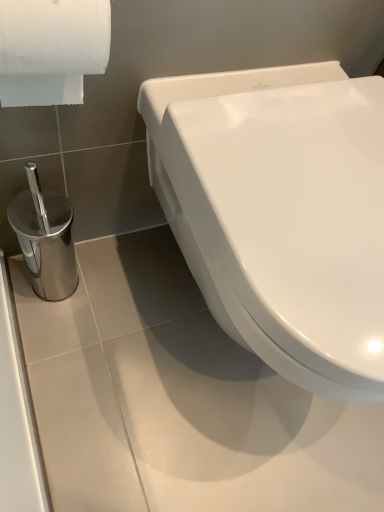
Locate an element on the screen. The image size is (384, 512). vacant space situated above white glossy toilet at center (from a real-world perspective) is located at coordinates tap(316, 179).